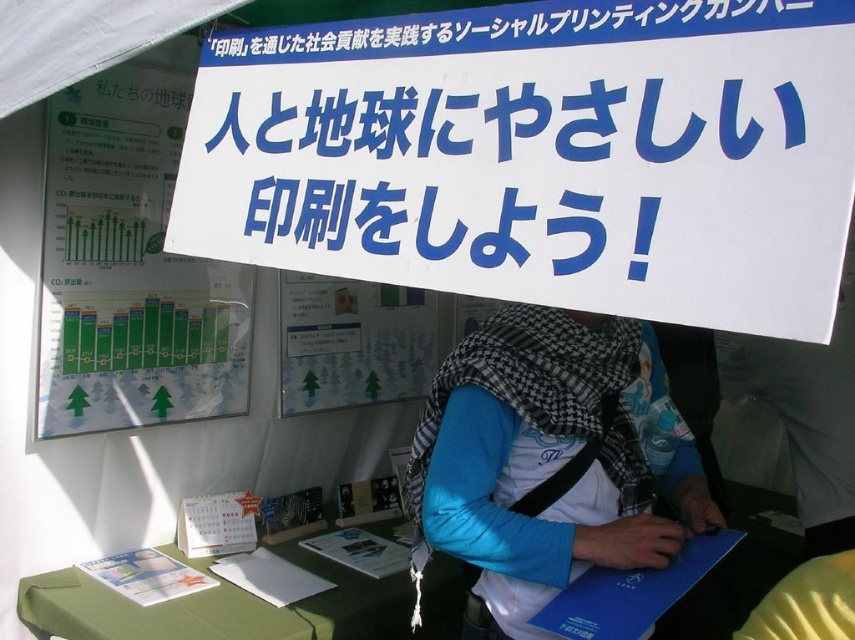
You are organizing an event and need to place a name tag on the blue cotton shirt at center. Where exactly should you place it according to the coordinates provided?

The blue cotton shirt at center is located at point (550, 460), so the name tag should be placed at those coordinates to ensure proper positioning.

Looking at this image, you are a photographer at the event and want to take a photo that includes both point (568, 204) and point (632, 378). Which point should you position closer to the camera to ensure both are in focus?

Point (568, 204) is closer to the viewer than point (632, 378). To ensure both are in focus, position the camera so that the closer point (568, 204) is near the focal plane, and the farther point (632, 378) is within the depth of field.